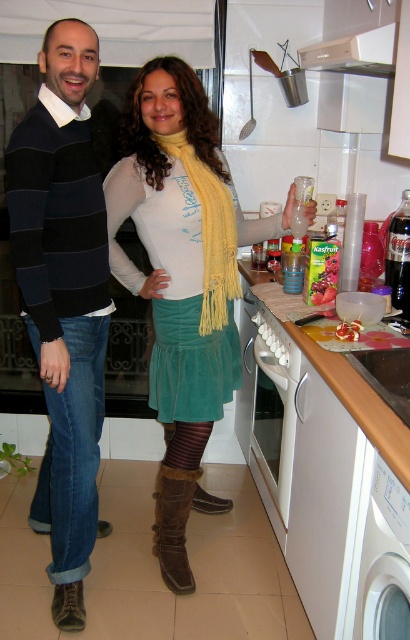
You are organizing a kitchen event and need to place the velvet green skirt at center and the white plastic dishwasher at lower right. Given their sizes, which object should be placed first to ensure proper fitting in the space?

The velvet green skirt at center is larger in size than the white plastic dishwasher at lower right, so you should place the velvet green skirt at center first to accommodate its larger size before placing the smaller dishwasher.

You are a delivery person who needs to place a package on the white plastic dishwasher at lower right. However, there is a velvet green skirt at center in the way. Can you move the skirt to access the dishwasher?

The velvet green skirt at center is positioned over the white plastic dishwasher at lower right, so you need to move the velvet green skirt at center to access the dishwasher.